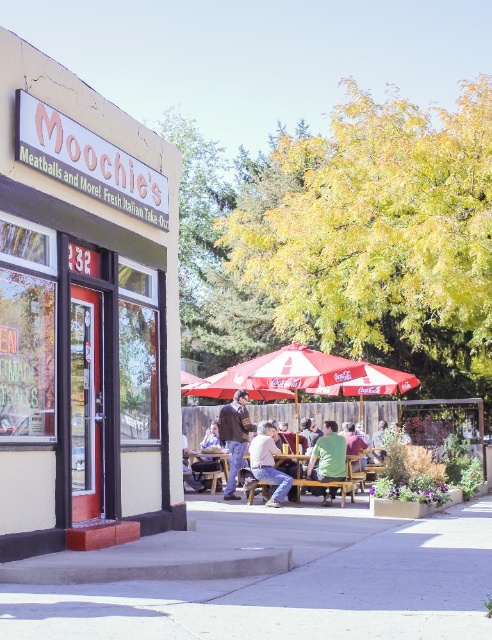
Is knitted sweater at center smaller than light brown leather jacket at center?

Yes, knitted sweater at center is smaller than light brown leather jacket at center.

Does knitted sweater at center have a larger size compared to light brown leather jacket at center?

Actually, knitted sweater at center might be smaller than light brown leather jacket at center.

The height and width of the screenshot is (640, 492). Identify the location of knitted sweater at center. (235, 436).

Between gray concrete pavement at lower center and wooden table at center, which one is positioned higher?

gray concrete pavement at lower center is above.

Which is more to the left, gray concrete pavement at lower center or wooden table at center?

wooden table at center

Does point (488, 496) lie in front of point (215, 456)?

No, (488, 496) is behind (215, 456).

You are a GUI agent. You are given a task and a screenshot of the screen. Output one action in this format:
    pyautogui.click(x=<x>, y=<y>)
    Task: Click on the gray concrete pavement at lower center
    This screenshot has width=492, height=640.
    Given the screenshot: What is the action you would take?
    pyautogui.click(x=291, y=582)

Is beige painted building at center taller than light brown leather jacket at center?

Correct, beige painted building at center is much taller as light brown leather jacket at center.

Who is taller, beige painted building at center or light brown leather jacket at center?

Standing taller between the two is beige painted building at center.

Between point (136, 372) and point (281, 492), which one is positioned behind?

Positioned behind is point (281, 492).

Image resolution: width=492 pixels, height=640 pixels. What are the coordinates of `beige painted building at center` in the screenshot? It's located at (84, 316).